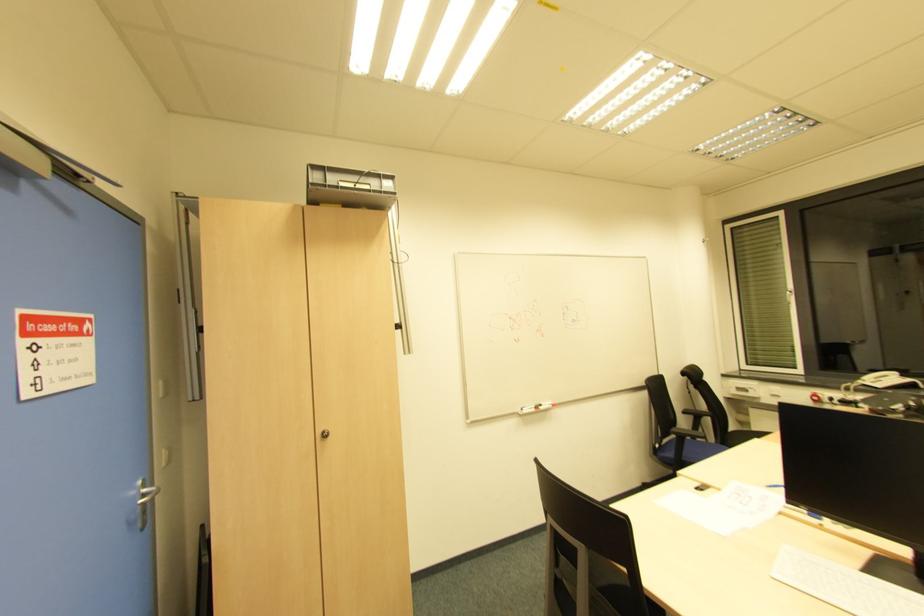
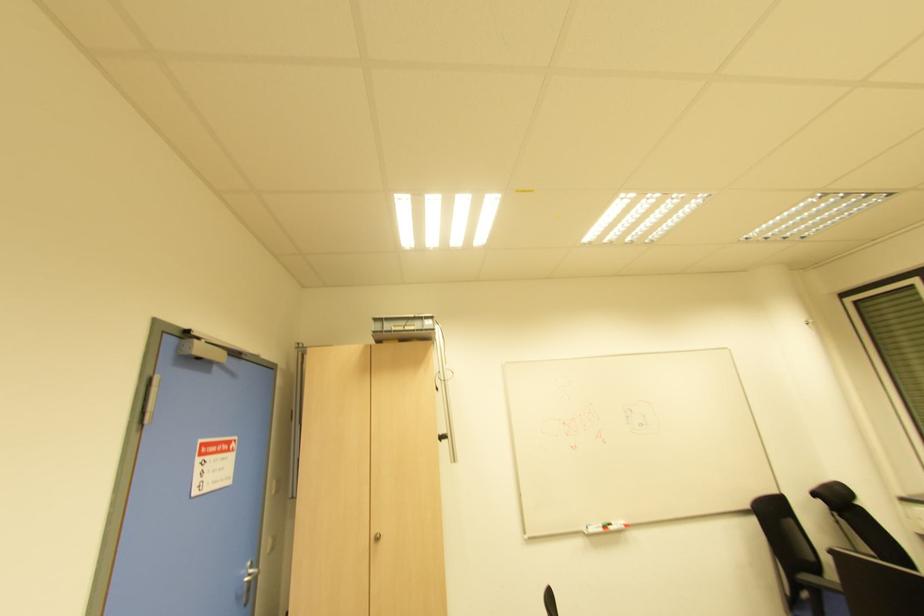
The images are taken continuously from a first-person perspective. In which direction are you moving?

The cameraman moved toward right, backward.